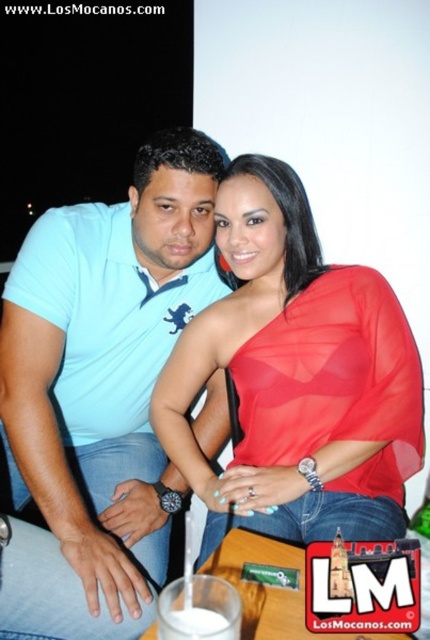
Is light blue cotton shirt at center closer to the viewer compared to shiny red blouse at center?

Yes.

Does light blue cotton shirt at center have a larger size compared to shiny red blouse at center?

Yes, light blue cotton shirt at center is bigger than shiny red blouse at center.

The image size is (430, 640). What are the coordinates of `light blue cotton shirt at center` in the screenshot? It's located at (107, 365).